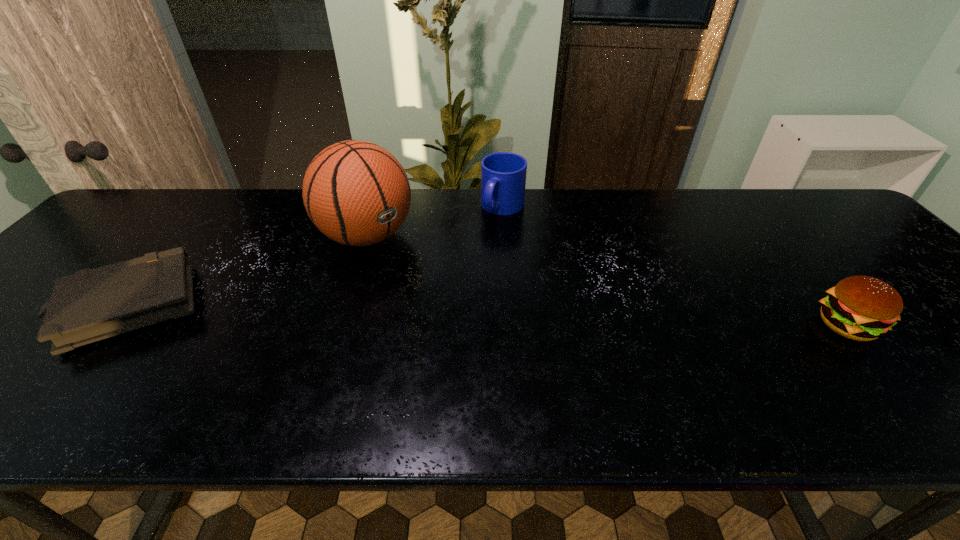
This screenshot has height=540, width=960. Find the location of `vacant space situated 0.370m on the side with the handle of the second object from right to left`. vacant space situated 0.370m on the side with the handle of the second object from right to left is located at coordinates (430, 306).

Where is `free space located 0.050m on the side with the handle of the second object from right to left`? The height and width of the screenshot is (540, 960). free space located 0.050m on the side with the handle of the second object from right to left is located at coordinates (488, 232).

In order to click on vacant area situated on the side where the inflation valve is located in this screenshot , I will do `click(409, 270)`.

Identify the location of blank space located on the side where the inflation valve is located. Image resolution: width=960 pixels, height=540 pixels. (436, 292).

This screenshot has height=540, width=960. I want to click on vacant space located on the side where the inflation valve is located, so click(x=428, y=286).

Identify the location of mug at the far edge. (503, 174).

Locate an element on the screen. Image resolution: width=960 pixels, height=540 pixels. basketball that is at the far edge is located at coordinates (355, 192).

What are the coordinates of `Bible located in the near edge section of the desktop` in the screenshot? It's located at (93, 304).

You are a GUI agent. You are given a task and a screenshot of the screen. Output one action in this format:
    pyautogui.click(x=<x>, y=<y>)
    Task: Click on the hamburger located in the near edge section of the desktop
    The image size is (960, 540).
    Given the screenshot: What is the action you would take?
    pyautogui.click(x=862, y=308)

You are a GUI agent. You are given a task and a screenshot of the screen. Output one action in this format:
    pyautogui.click(x=<x>, y=<y>)
    Task: Click on the object present at the left edge
    
    Given the screenshot: What is the action you would take?
    pyautogui.click(x=93, y=304)